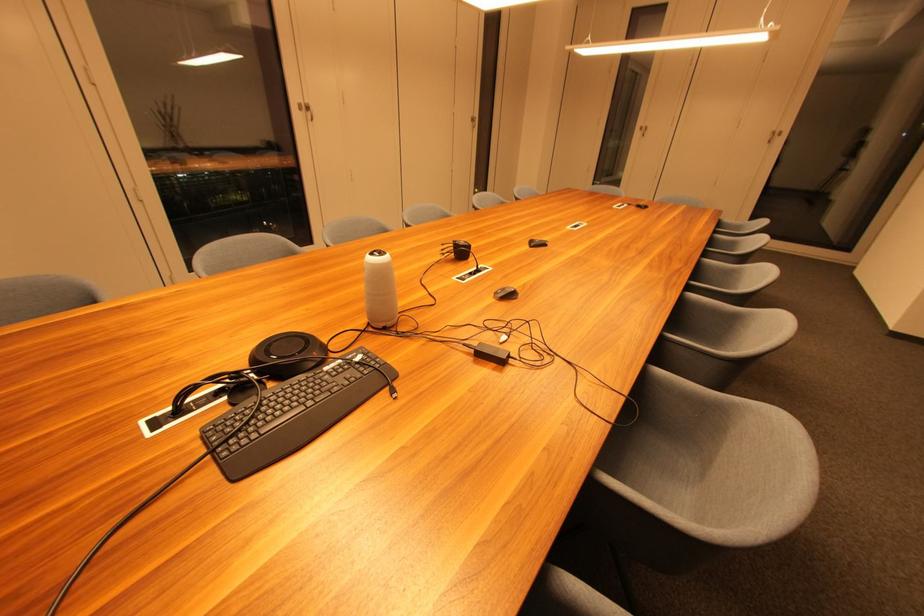
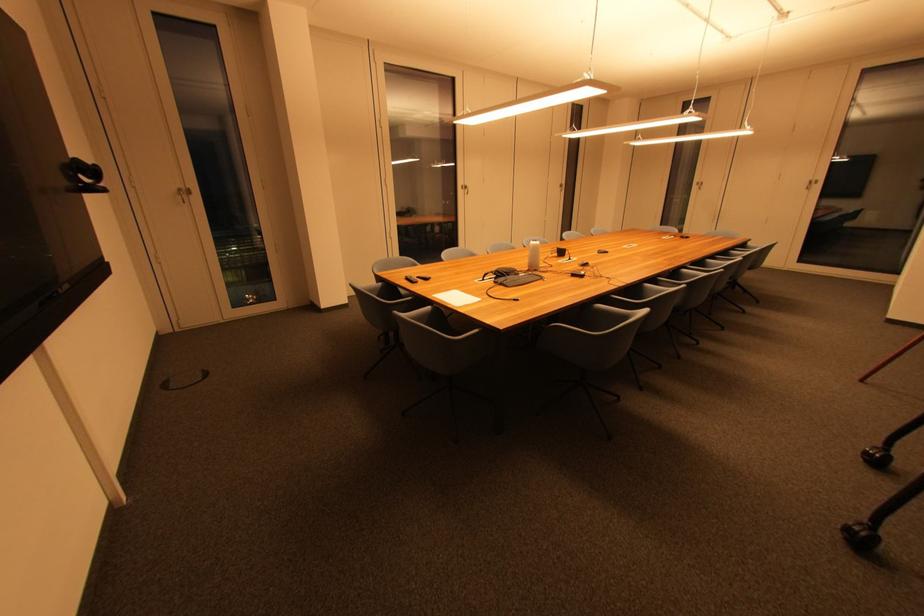
Locate, in the second image, the point that corresponds to point (306, 111) in the first image.

(468, 190)